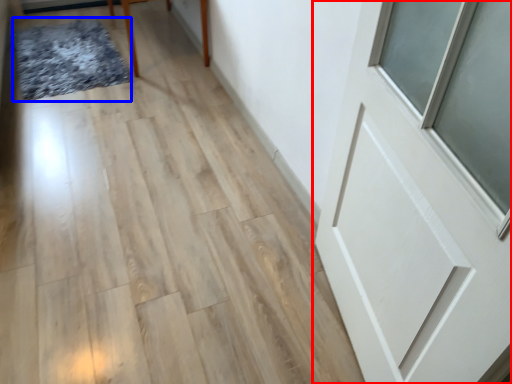
Question: Among these objects, which one is nearest to the camera, door (highlighted by a red box) or mat (highlighted by a blue box)?

Choices:
 (A) door
 (B) mat

Answer: (A)